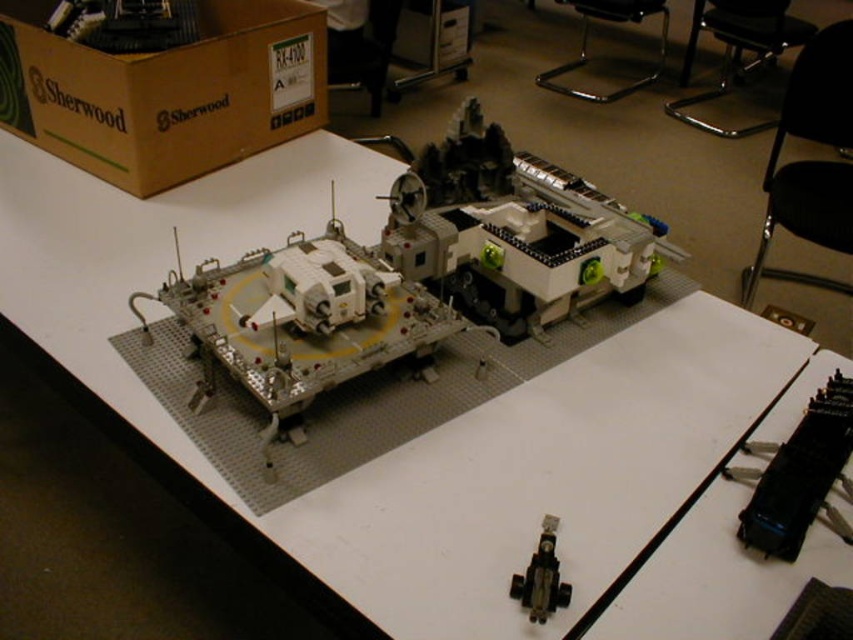
Question: Which of the following is the closest to the observer?

Choices:
 (A) (279, 390)
 (B) (376, 316)

Answer: (A)

Question: Which object is farther from the camera taking this photo?

Choices:
 (A) brown cardboard box at upper left
 (B) beige plastic space vehicle at center
 (C) metallic black usb drive at lower center

Answer: (A)

Question: Which is farther from the black plastic train at lower right?

Choices:
 (A) brown cardboard box at upper left
 (B) metallic black usb drive at lower center
 (C) beige plastic space vehicle at center
 (D) white plastic vehicle at center

Answer: (A)

Question: Does beige plastic space vehicle at center have a lesser width compared to black plastic train at lower right?

Choices:
 (A) no
 (B) yes

Answer: (A)

Question: Does white plastic vehicle at center have a larger size compared to metallic black usb drive at lower center?

Choices:
 (A) no
 (B) yes

Answer: (B)

Question: Considering the relative positions of brown cardboard box at upper left and white plastic vehicle at center in the image provided, where is brown cardboard box at upper left located with respect to white plastic vehicle at center?

Choices:
 (A) left
 (B) right

Answer: (A)